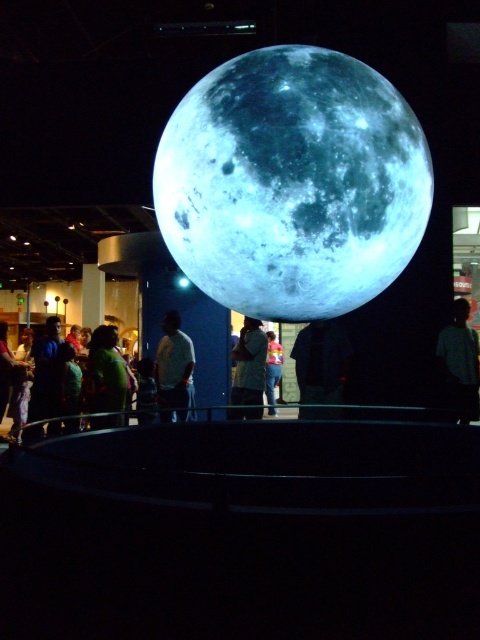
Does shiny metallic moon at center appear on the left side of green fabric shirt at left?

In fact, shiny metallic moon at center is to the right of green fabric shirt at left.

Can you confirm if shiny metallic moon at center is positioned below green fabric shirt at left?

Incorrect, shiny metallic moon at center is not positioned below green fabric shirt at left.

Is point (396, 246) closer to camera compared to point (0, 362)?

That is True.

What are the coordinates of `shiny metallic moon at center` in the screenshot? It's located at (292, 182).

How distant is green fabric shirt at lower left from yellow-green fabric shirt at center?

A distance of 4.24 meters exists between green fabric shirt at lower left and yellow-green fabric shirt at center.

Can you confirm if green fabric shirt at lower left is taller than yellow-green fabric shirt at center?

No.

Does point (101, 348) come closer to viewer compared to point (271, 396)?

Yes, point (101, 348) is in front of point (271, 396).

This screenshot has height=640, width=480. Identify the location of green fabric shirt at lower left. (106, 371).

Does point (231, 356) lie behind point (8, 385)?

Yes.

Is point (252, 352) positioned before point (21, 396)?

Yes.

Does point (251, 324) come in front of point (13, 381)?

Yes.

Identify the location of blue fabric shirt at center. (250, 364).